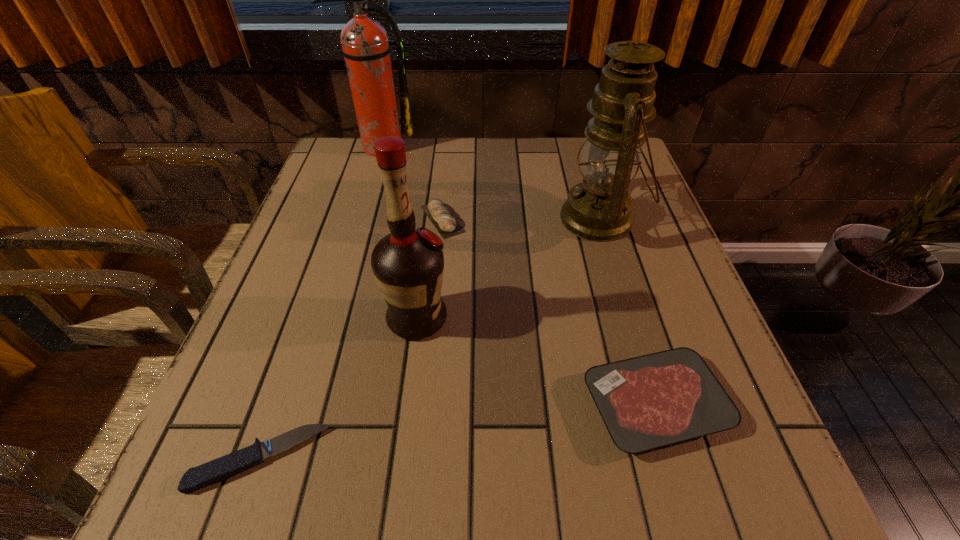
In order to click on free point that satisfies the following two spatial constraints: 1. on the back side of the third shortest object; 2. on the right side of the oil lamp in this screenshot , I will do `click(443, 219)`.

This screenshot has width=960, height=540. Find the location of `free point that satisfies the following two spatial constraints: 1. on the front and back of the liquor; 2. on the right side of the steak`. free point that satisfies the following two spatial constraints: 1. on the front and back of the liquor; 2. on the right side of the steak is located at coordinates (406, 404).

Image resolution: width=960 pixels, height=540 pixels. What are the coordinates of `free space that satisfies the following two spatial constraints: 1. at the nozzle of the fire extinguisher; 2. on the left side of the steak` in the screenshot? It's located at (301, 404).